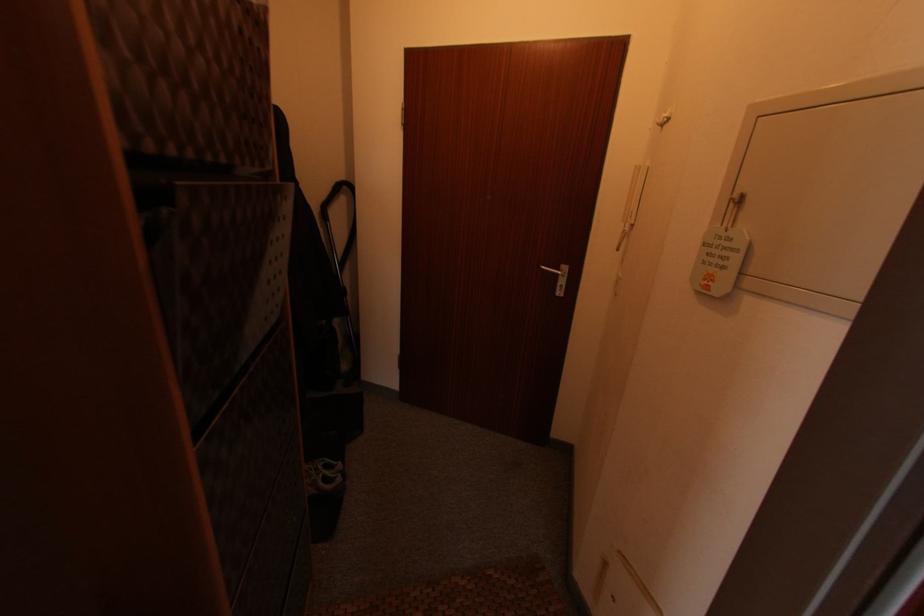
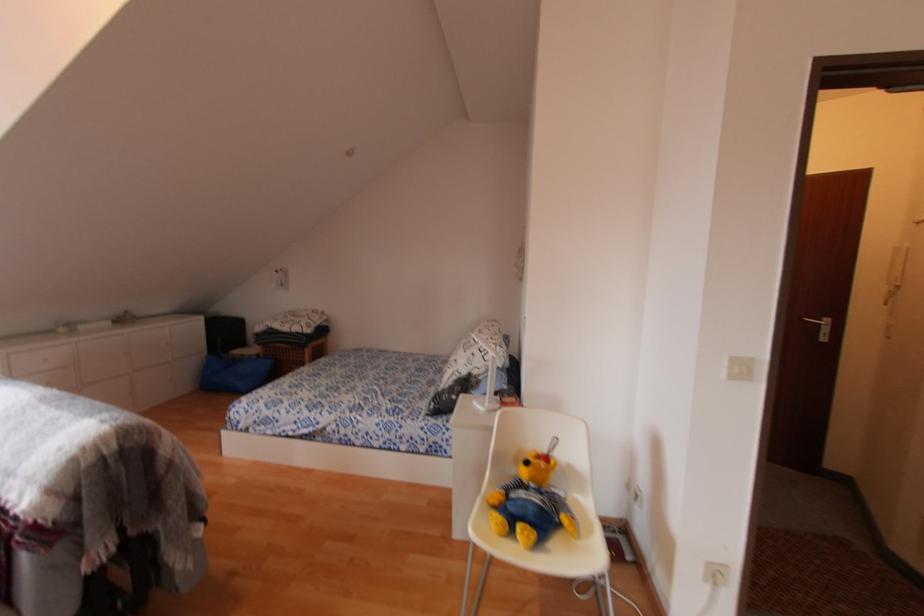
Locate, in the second image, the point that corresponds to [565,268] in the first image.

(828, 321)